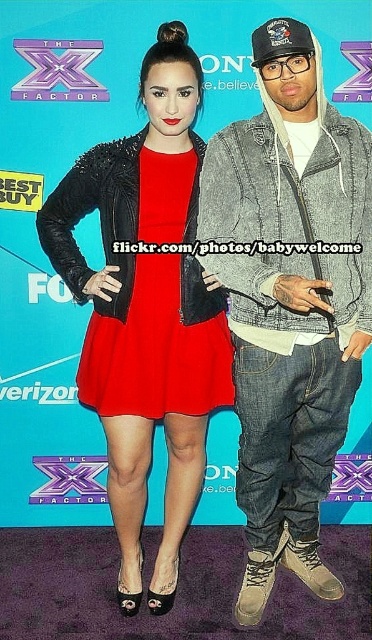
You are a photographer at the event and need to adjust the lighting to ensure both the denim jacket at center and the matte red dress at center are well lit. Based on their positions, which one might require more direct light to avoid shadows?

The denim jacket at center is positioned under the matte red dress at center, so it might require more direct light to avoid shadows since it is in a lower position and could be in shadow from the dress above.

You are standing in front of the X Factor promotional backdrop and want to place two stickers on the exact coordinates of point (126, 280) and point (145, 182). Which sticker will be closer to the foreground of the image?

Point (145, 182) is closer to the foreground because it is in front of point (126, 280).

You are a photographer at the event and want to ensure both the denim jacket at center and the matte black dress at center are visible in your shot. Given their heights, which one might require you to adjust your camera angle to capture fully?

The denim jacket at center has a lesser height compared to the matte black dress at center, so you might need to lower your camera angle slightly to ensure the denim jacket at center is fully visible while still capturing the taller matte black dress at center in the frame.